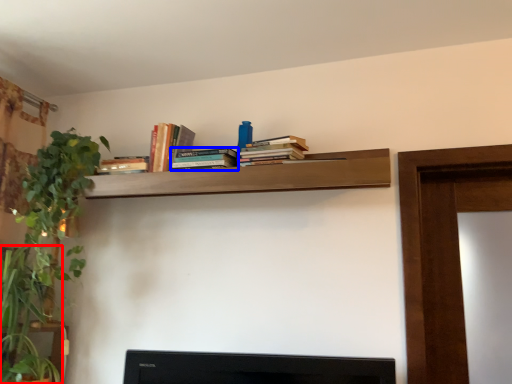
Question: Which object appears farthest to the camera in this image, plant (highlighted by a red box) or book (highlighted by a blue box)?

Choices:
 (A) plant
 (B) book

Answer: (B)